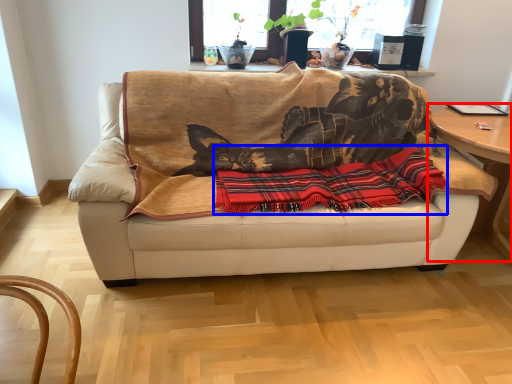
Question: Which object is closer to the camera taking this photo, table (highlighted by a red box) or plaid (highlighted by a blue box)?

Choices:
 (A) table
 (B) plaid

Answer: (B)